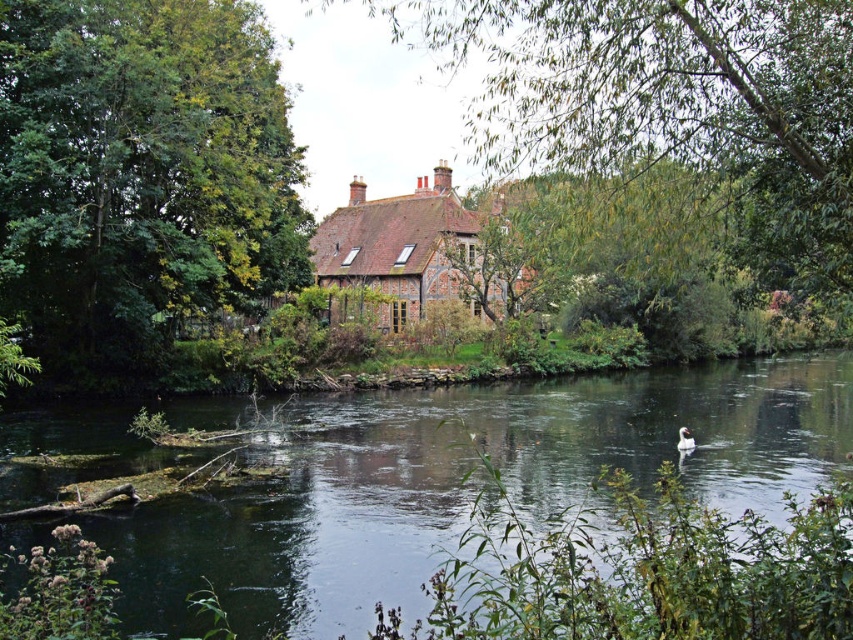
Question: Which of the following is the farthest from the observer?

Choices:
 (A) green leafy tree at center
 (B) greenish water at center
 (C) green leafy tree at left
 (D) brown brick cottage at center

Answer: (D)

Question: Does green leafy tree at center appear over brown brick cottage at center?

Choices:
 (A) no
 (B) yes

Answer: (B)

Question: Is green leafy tree at left positioned in front of brown brick cottage at center?

Choices:
 (A) no
 (B) yes

Answer: (B)

Question: Which point is closer to the camera taking this photo?

Choices:
 (A) (453, 230)
 (B) (599, 116)

Answer: (B)

Question: Is green leafy tree at center further to camera compared to brown brick cottage at center?

Choices:
 (A) yes
 (B) no

Answer: (B)

Question: Which of the following is the closest to the observer?

Choices:
 (A) (126, 204)
 (B) (566, 74)

Answer: (B)